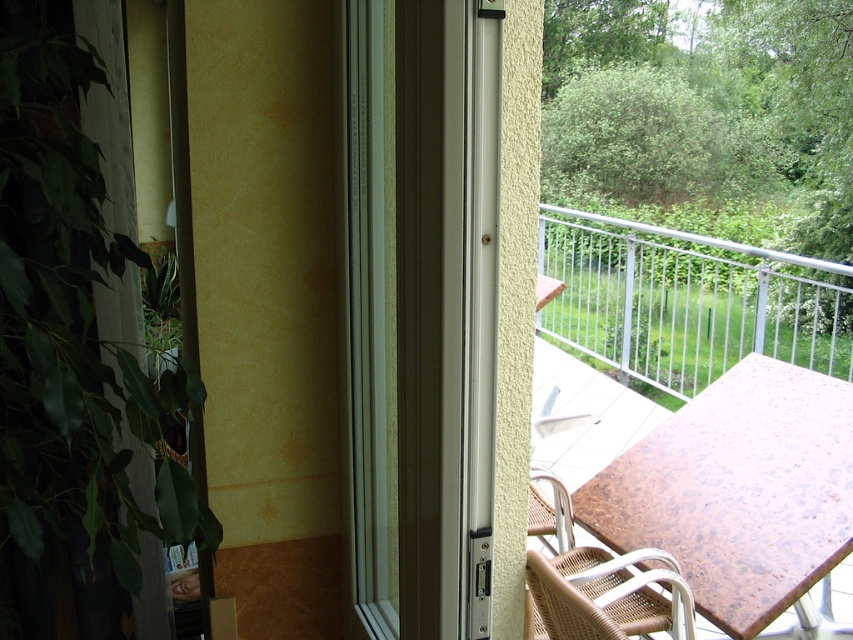
Identify the location of white plastic screen door at center. (422, 308).

Who is higher up, white plastic screen door at center or brown marble table at center?

white plastic screen door at center

Find the location of `white plastic screen door at center`. white plastic screen door at center is located at coordinates (422, 308).

You are a GUI agent. You are given a task and a screenshot of the screen. Output one action in this format:
    pyautogui.click(x=<x>, y=<y>)
    Task: Click on the white plastic screen door at center
    
    Given the screenshot: What is the action you would take?
    pyautogui.click(x=422, y=308)

Based on the photo, does white metallic screen door at center have a lesser width compared to woven brown chair at lower right?

Correct, white metallic screen door at center's width is less than woven brown chair at lower right's.

This screenshot has width=853, height=640. What do you see at coordinates (479, 301) in the screenshot?
I see `white metallic screen door at center` at bounding box center [479, 301].

Find the location of a particular element. white metallic screen door at center is located at coordinates (479, 301).

Can you confirm if white plastic screen door at center is taller than white metallic screen door at center?

Yes.

Between white plastic screen door at center and white metallic screen door at center, which one has less height?

With less height is white metallic screen door at center.

Is point (416, 337) positioned behind point (489, 557)?

That is False.

Where is `white plastic screen door at center`? The image size is (853, 640). white plastic screen door at center is located at coordinates (422, 308).